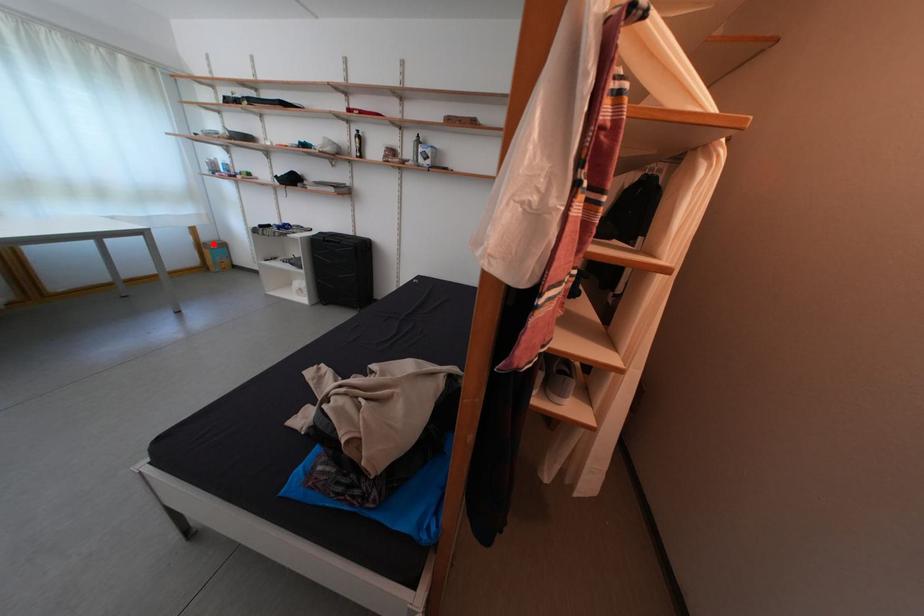
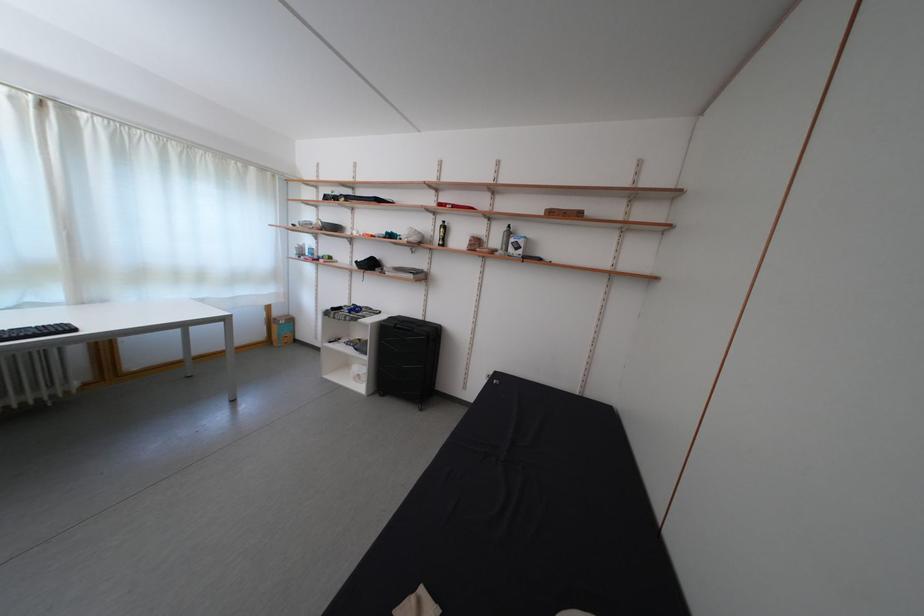
Question: I am providing you with two images of the same scene from different viewpoints. Given a red point in image1, look at the same physical point in image2. Is it:

Choices:
 (A) Closer to the viewpoint
 (B) Farther from the viewpoint

Answer: (B)